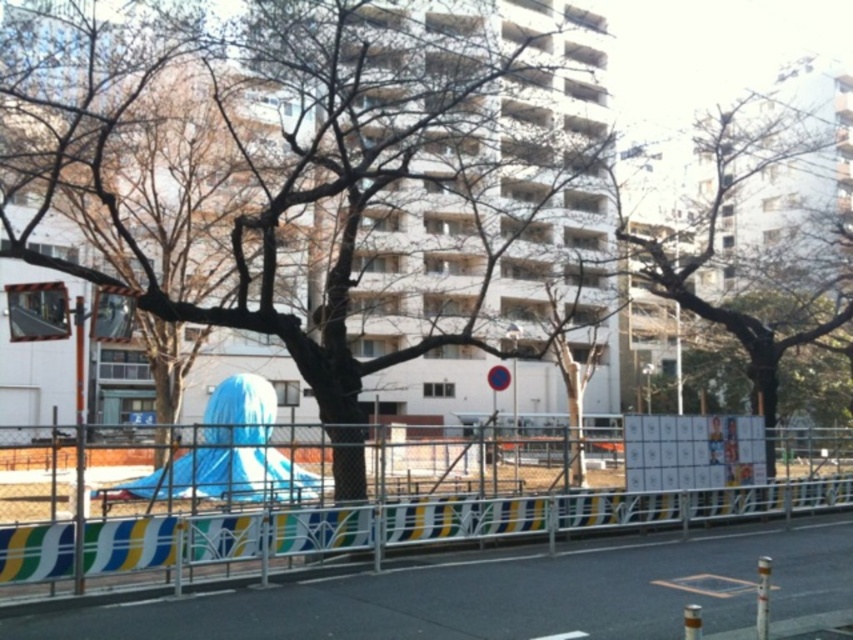
Question: Does brown rough bark tree at center appear under metallic silver fence at center?

Choices:
 (A) yes
 (B) no

Answer: (B)

Question: Can you confirm if metallic silver fence at center is positioned above bare wood tree at center?

Choices:
 (A) yes
 (B) no

Answer: (B)

Question: Which point is farther to the camera?

Choices:
 (A) bare wood tree at center
 (B) brown rough bark tree at center
 (C) metallic silver fence at center

Answer: (A)

Question: Does metallic silver fence at center have a greater width compared to bare wood tree at center?

Choices:
 (A) yes
 (B) no

Answer: (A)

Question: Estimate the real-world distances between objects in this image. Which object is closer to the metallic silver fence at center?

Choices:
 (A) brown rough bark tree at center
 (B) bare wood tree at center

Answer: (B)

Question: Which of the following is the closest to the observer?

Choices:
 (A) (694, 310)
 (B) (120, 212)
 (C) (752, 488)

Answer: (C)